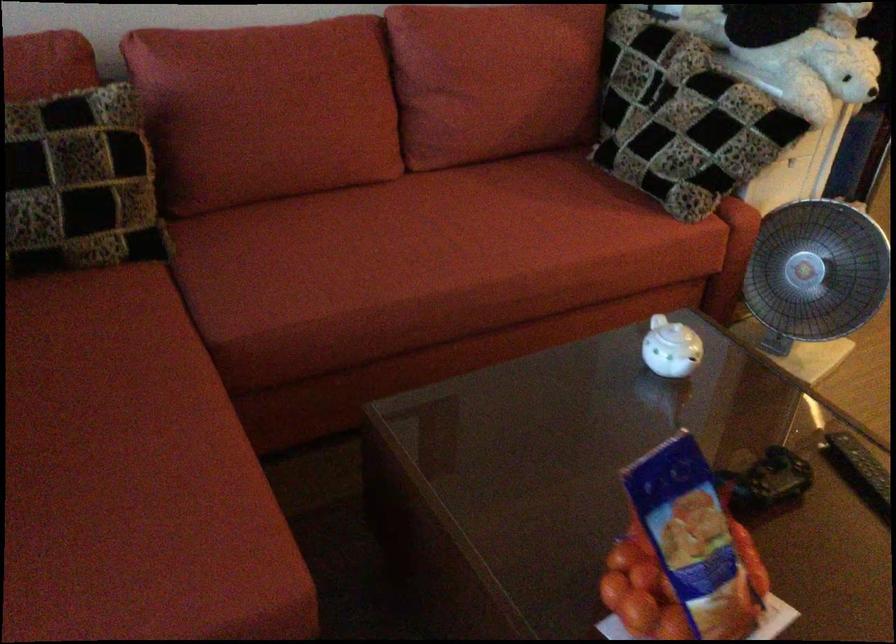
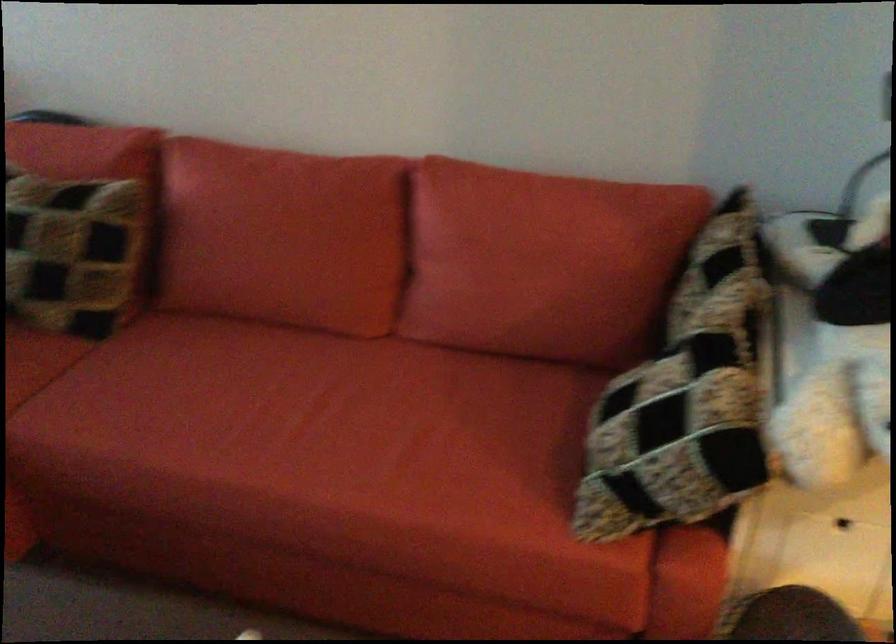
Where in the second image is the point corresponding to [85,138] from the first image?

(76, 223)